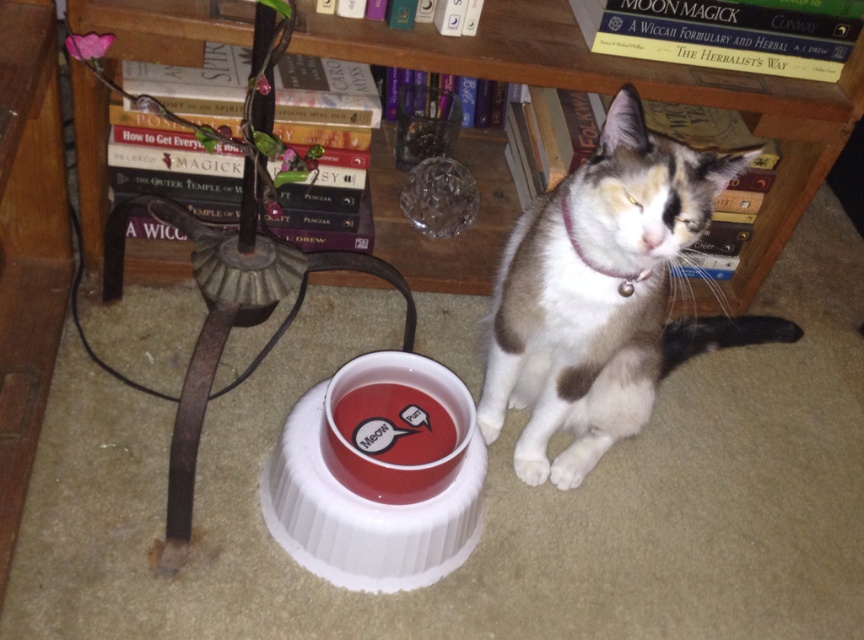
Question: Which of the following is the farthest from the observer?

Choices:
 (A) (353, 483)
 (B) (234, 24)

Answer: (B)

Question: Is wooden bookcase at upper center smaller than white fur cat at center?

Choices:
 (A) no
 (B) yes

Answer: (A)

Question: Observing the image, what is the correct spatial positioning of wooden bookcase at upper center in reference to matte red bowl at center?

Choices:
 (A) below
 (B) above

Answer: (B)

Question: Which point is closer to the camera?

Choices:
 (A) wooden bookcase at upper center
 (B) matte red bowl at center

Answer: (B)

Question: Is the position of wooden bookcase at upper center less distant than that of matte red bowl at center?

Choices:
 (A) no
 (B) yes

Answer: (A)

Question: Which object appears farthest from the camera in this image?

Choices:
 (A) white fur cat at center
 (B) matte red bowl at center
 (C) wooden bookcase at upper center

Answer: (C)